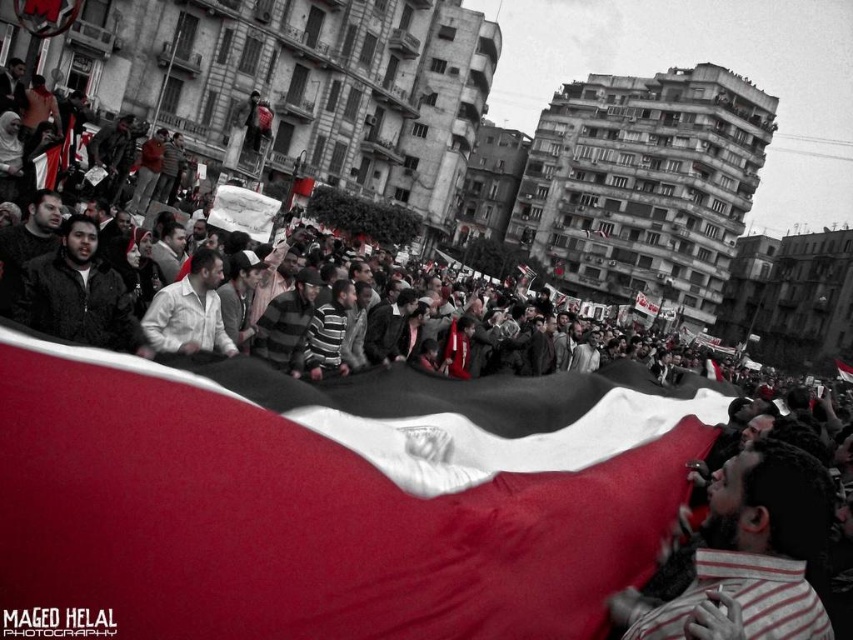
Does striped shirt at lower right appear over white matte shirt at center?

Actually, striped shirt at lower right is below white matte shirt at center.

Consider the image. Is striped shirt at lower right to the left of white matte shirt at center from the viewer's perspective?

In fact, striped shirt at lower right is to the right of white matte shirt at center.

Which is in front, point (737, 518) or point (213, 259)?

Point (737, 518)

Identify the location of striped shirt at lower right. Image resolution: width=853 pixels, height=640 pixels. (751, 554).